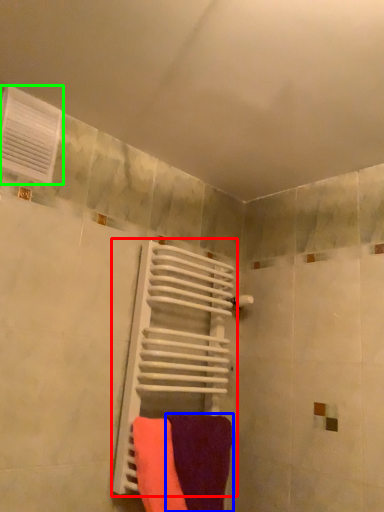
Question: Estimate the real-world distances between objects in this image. Which object is farther from radiator (highlighted by a red box), towel (highlighted by a blue box) or air conditioning (highlighted by a green box)?

Choices:
 (A) towel
 (B) air conditioning

Answer: (B)